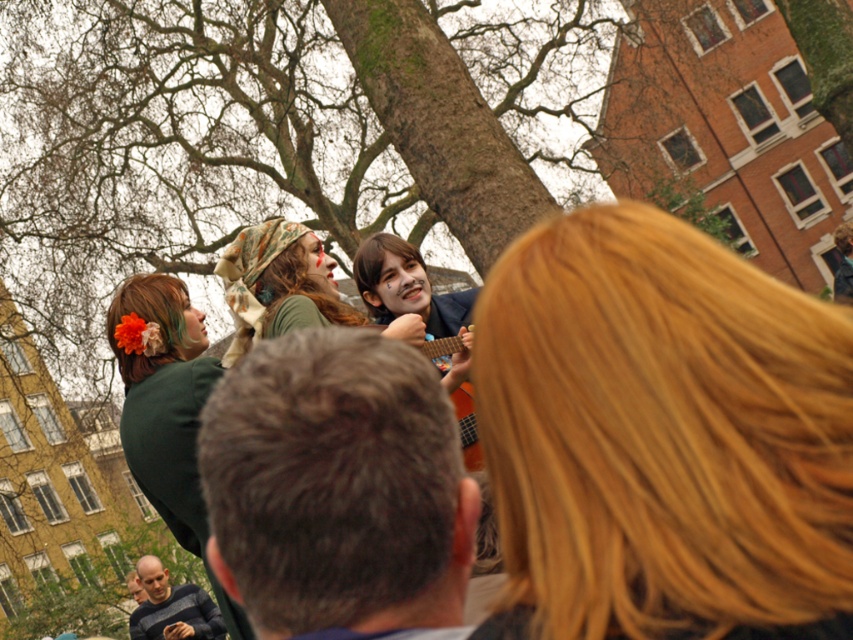
Measure the distance between point (x=99, y=44) and camera.

Point (x=99, y=44) and camera are 105.15 meters apart from each other.

Does point (41, 248) come closer to viewer compared to point (173, 624)?

No.

The height and width of the screenshot is (640, 853). Find the location of `brown rough bark tree at center`. brown rough bark tree at center is located at coordinates (177, 147).

Is point (682, 257) positioned after point (317, 141)?

No, (682, 257) is in front of (317, 141).

Which is below, blonde hair at center or brown rough bark tree at center?

blonde hair at center

Does point (498, 289) come behind point (581, 170)?

No.

Locate an element on the screen. blonde hair at center is located at coordinates (662, 436).

From the picture: Who is more distant from viewer, (183, 598) or (456, 397)?

The point (183, 598) is more distant.

Image resolution: width=853 pixels, height=640 pixels. Identify the location of smooth gray sweater at lower left. 172,608.

Measure the distance between point (138, 634) and camera.

Point (138, 634) and camera are 87.64 meters apart from each other.

Where is `smooth gray sweater at lower left`? smooth gray sweater at lower left is located at coordinates (172, 608).